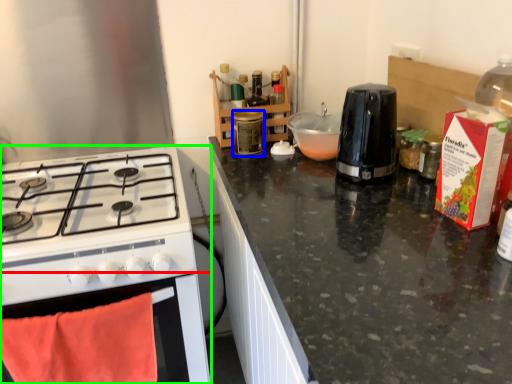
Question: Which object is positioned farthest from oven (highlighted by a red box)? Select from bottle (highlighted by a blue box) and kitchen appliance (highlighted by a green box).

Choices:
 (A) bottle
 (B) kitchen appliance

Answer: (A)